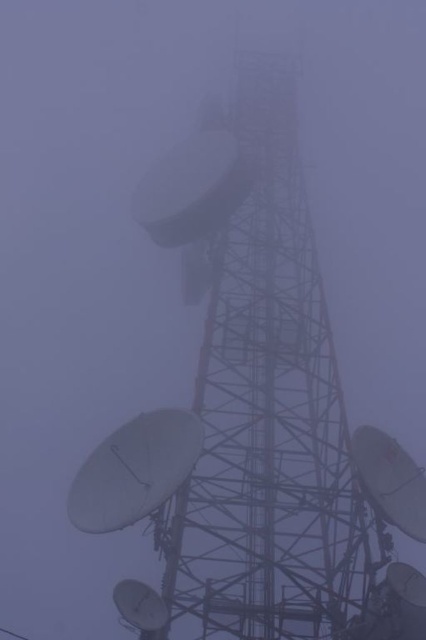
You are a technician standing at the base of the communication tower. You need to reach both the metallic gray satellite dish at center and the white matte satellite at center for maintenance. Given that your ladder can extend up to 10 meters, can you safely reach both objects with your current equipment?

The metallic gray satellite dish at center is 12.00 meters away from the white matte satellite at center. Since your ladder can only extend up to 10 meters, you cannot safely reach both objects with your current equipment as the distance between them exceeds the ladder length.

Looking at this image, you are a technician who needs to locate a specific point on the satellite dish. The point is at coordinates point (258, 388). Where exactly is this point located on the satellite dish?

The point (258, 388) is located on the metallic gray satellite dish at center.

You are an engineer inspecting the communication tower. You notice two satellite dishes at the center of the tower. Which one is nearer to you, the metallic gray satellite dish at center or the white matte satellite at center?

The metallic gray satellite dish at center is closer to the viewer than the white matte satellite at center.